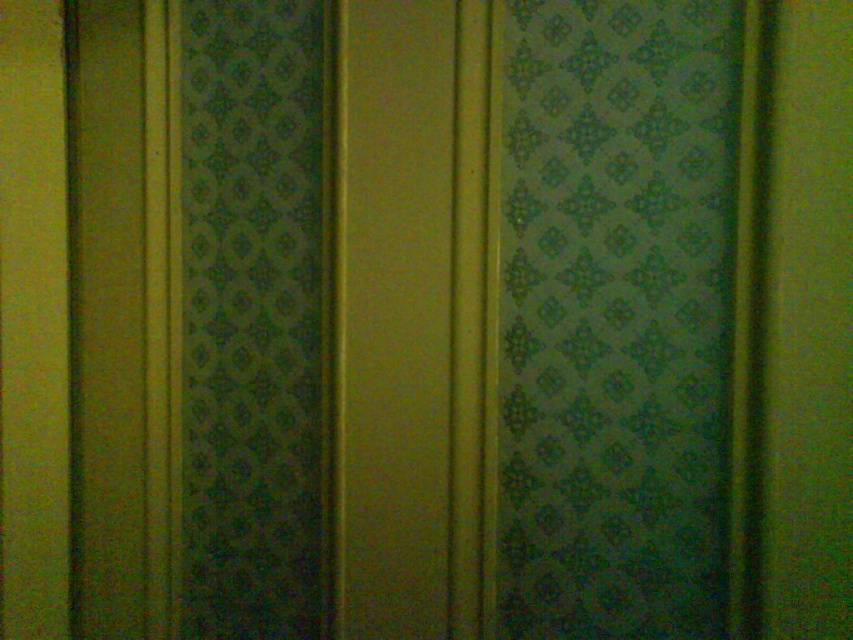
Question: Can you confirm if green patterned curtain at right is thinner than green patterned curtain at left?

Choices:
 (A) no
 (B) yes

Answer: (A)

Question: Which object appears closest to the camera in this image?

Choices:
 (A) green patterned curtain at left
 (B) green patterned curtain at right

Answer: (B)

Question: Does green patterned curtain at right lie in front of green patterned curtain at left?

Choices:
 (A) no
 (B) yes

Answer: (B)

Question: Can you confirm if green patterned curtain at right is smaller than green patterned curtain at left?

Choices:
 (A) no
 (B) yes

Answer: (A)